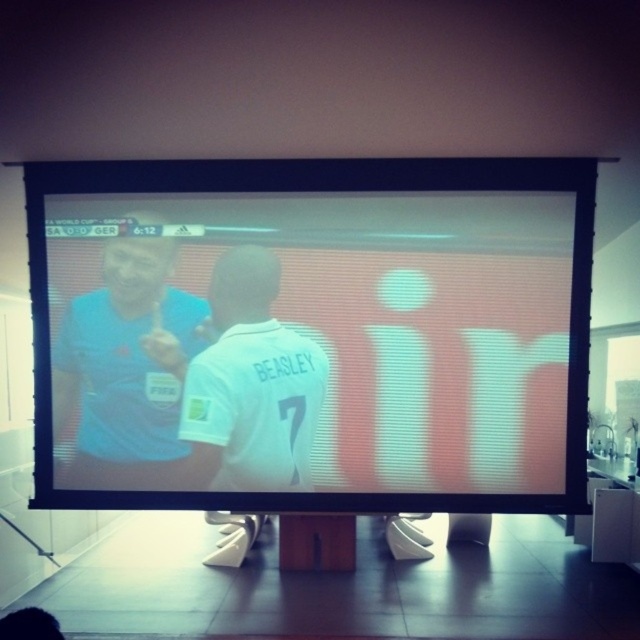
You are setting up a presentation and need to ensure that two items are placed at least 15 inches apart. You have a matte black monitor at center and a matte blue shirt at upper left. Based on the scene, will their current positions meet the requirement?

The matte black monitor at center is 15.19 inches away from the matte blue shirt at upper left, which exceeds the minimum required distance of 15 inches. Therefore, their current positions meet the requirement.

What are the coordinates of the matte black monitor at center?

The matte black monitor at center is located at coordinates point (310, 333).

You are a sports analyst watching the FIFA World Cup match between SA and GER on the screen. You need to focus on the white jersey at center and the matte black monitor at center. Which object is located to the right of the other?

The matte black monitor at center is positioned on the right side of white jersey at center, so the monitor is to the right of the jersey.